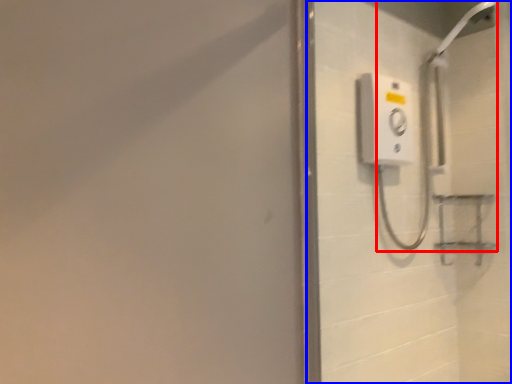
Question: Which of the following is the farthest to the observer, shower (highlighted by a red box) or screen door (highlighted by a blue box)?

Choices:
 (A) shower
 (B) screen door

Answer: (A)